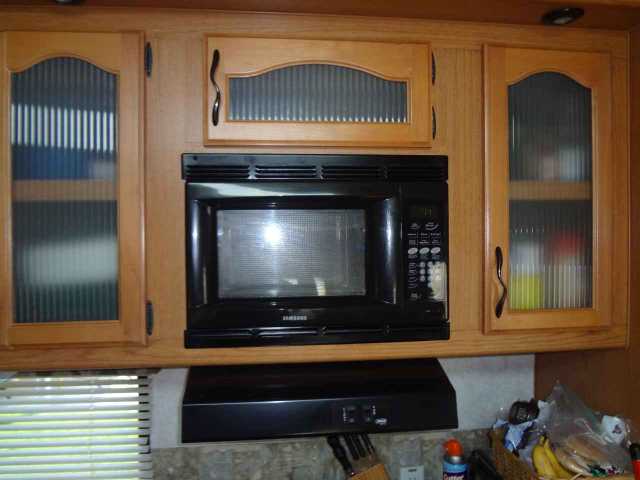
Where is `1 partial outlet`? 1 partial outlet is located at coordinates (415, 467).